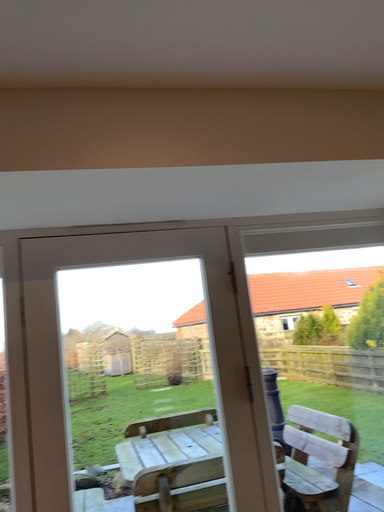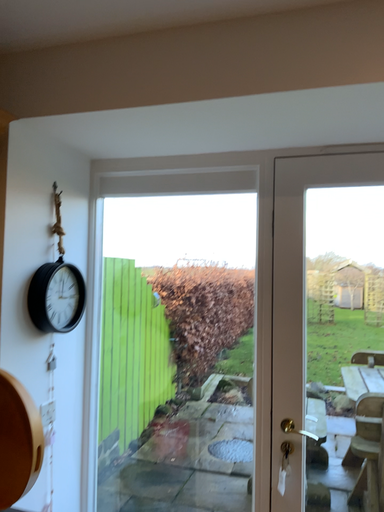
Question: Which way did the camera rotate in the video?

Choices:
 (A) rotated right
 (B) rotated left

Answer: (B)